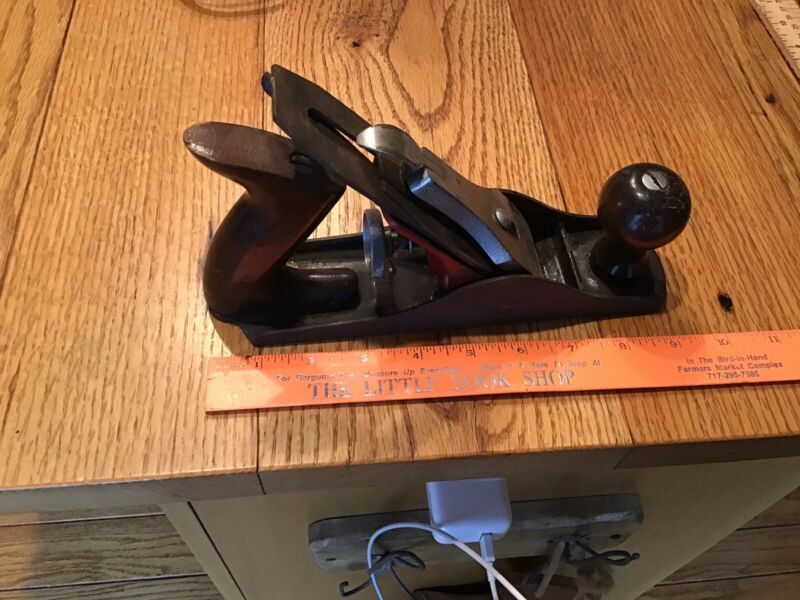
You are a GUI agent. You are given a task and a screenshot of the screen. Output one action in this format:
    pyautogui.click(x=<x>, y=<y>)
    Task: Click on the empty table space
    The width and height of the screenshot is (800, 600).
    Given the screenshot: What is the action you would take?
    pyautogui.click(x=460, y=53)